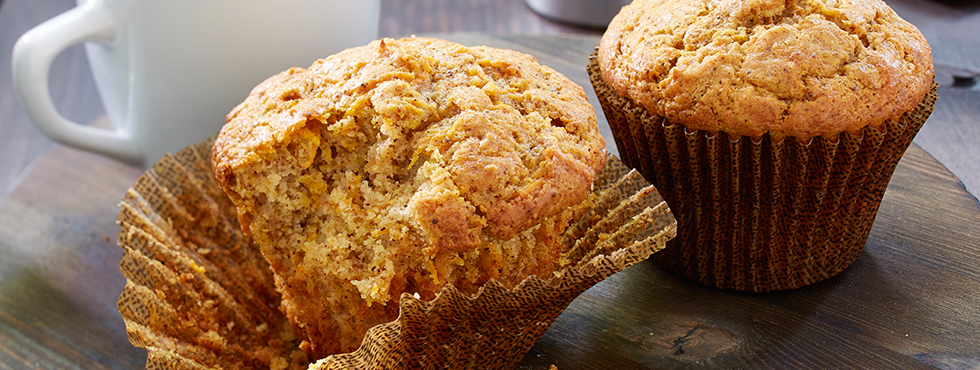
I want to click on wood board, so click(x=911, y=312).